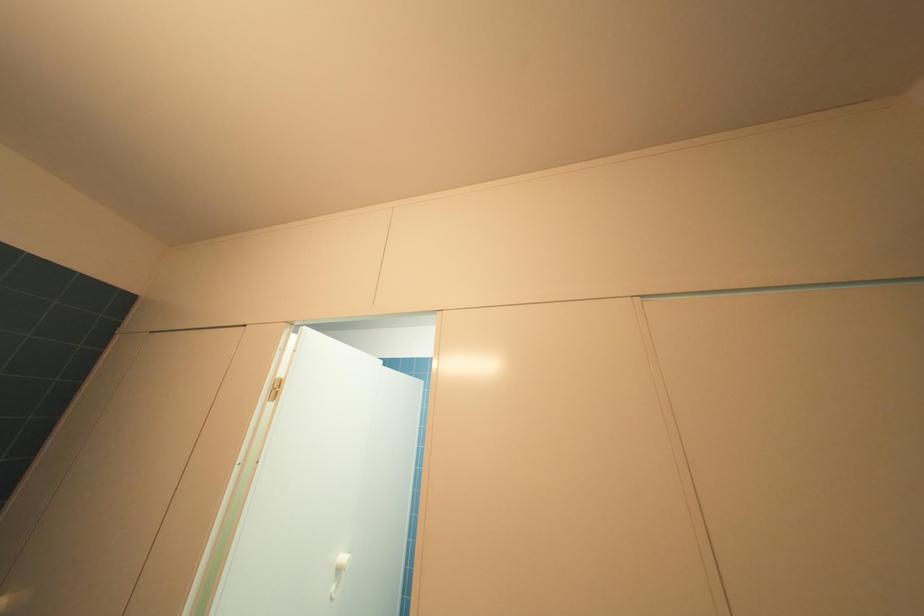
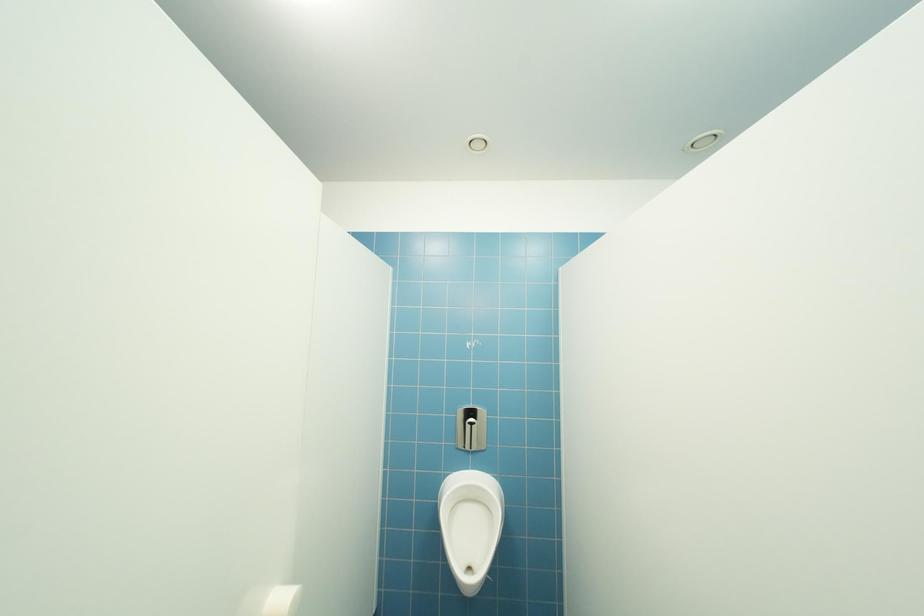
Question: The first image is from the beginning of the video and the second image is from the end. How did the camera likely rotate when shooting the video?

Choices:
 (A) Left
 (B) Right
 (C) Up
 (D) Down

Answer: (D)